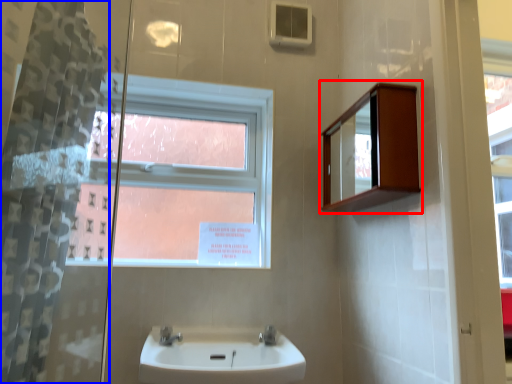
Question: Which point is closer to the camera, medicine cabinet (highlighted by a red box) or shower curtain (highlighted by a blue box)?

Choices:
 (A) medicine cabinet
 (B) shower curtain

Answer: (B)